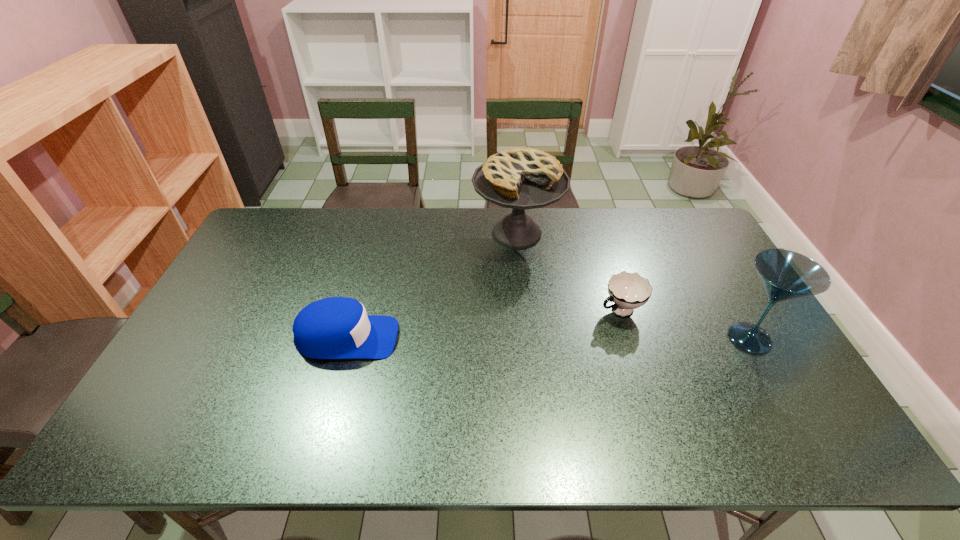
I want to click on vacant space located 0.150m on the cut side of the farthest object, so click(x=522, y=295).

The image size is (960, 540). Find the location of `free region located 0.070m on the cut side of the farthest object`. free region located 0.070m on the cut side of the farthest object is located at coordinates (520, 278).

Where is `vacant space situated on the cut side of the farthest object`? vacant space situated on the cut side of the farthest object is located at coordinates (528, 363).

Locate an element on the screen. object at the far edge is located at coordinates (523, 178).

Where is `object that is at the right edge`? This screenshot has height=540, width=960. object that is at the right edge is located at coordinates (786, 275).

Find the location of `vacant space at the far edge of the desktop`. vacant space at the far edge of the desktop is located at coordinates pos(384,234).

Find the location of a particular element. The width and height of the screenshot is (960, 540). vacant point at the near edge is located at coordinates (708, 402).

Identify the location of vacant space at the left edge of the desktop. (196, 324).

This screenshot has height=540, width=960. What are the coordinates of `vacant area at the right edge of the desktop` in the screenshot? It's located at (708, 271).

At what (x,y) coordinates should I click in order to perform the action: click on free space at the far left corner. Please return your answer as a coordinate pair (x, y). Looking at the image, I should click on (286, 219).